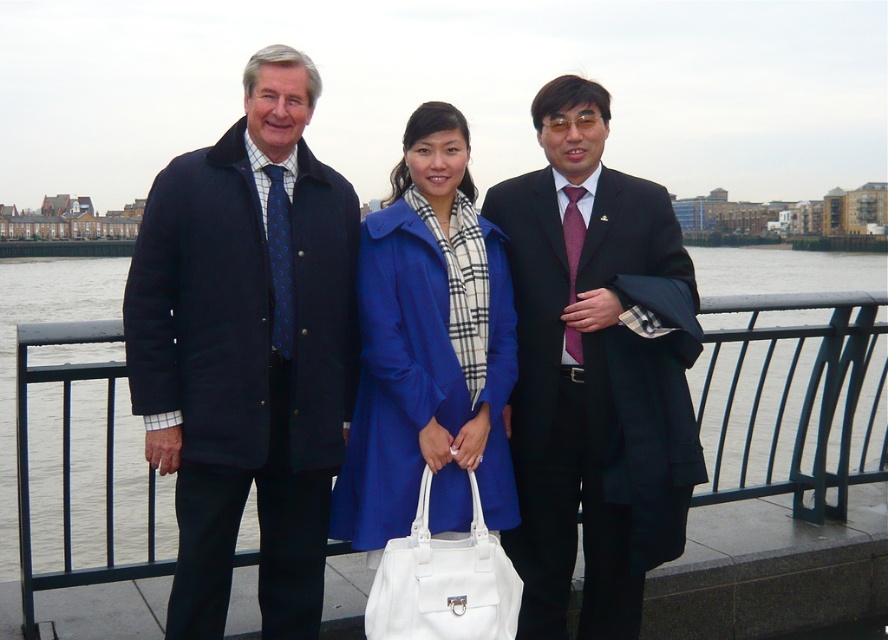
Who is shorter, navy wool coat at left or matte blue coat at center?

With less height is matte blue coat at center.

Does navy wool coat at left appear over matte blue coat at center?

No.

The image size is (888, 640). I want to click on navy wool coat at left, so click(x=247, y=349).

Does matte black coat at center have a lesser width compared to matte blue coat at center?

Incorrect, matte black coat at center's width is not less than matte blue coat at center's.

Is matte black coat at center behind matte blue coat at center?

Yes, it is.

Who is more distant from viewer, (x=513, y=513) or (x=462, y=147)?

Point (x=462, y=147)

This screenshot has width=888, height=640. In order to click on matte black coat at center in this screenshot , I will do `click(538, 364)`.

Is matte black coat at center bigger than white leather handbag at center?

Yes, matte black coat at center is bigger than white leather handbag at center.

Who is positioned more to the left, matte black coat at center or white leather handbag at center?

matte black coat at center

At what (x,y) coordinates should I click in order to perform the action: click on matte black coat at center. Please return your answer as a coordinate pair (x, y). This screenshot has width=888, height=640. Looking at the image, I should click on (538, 364).